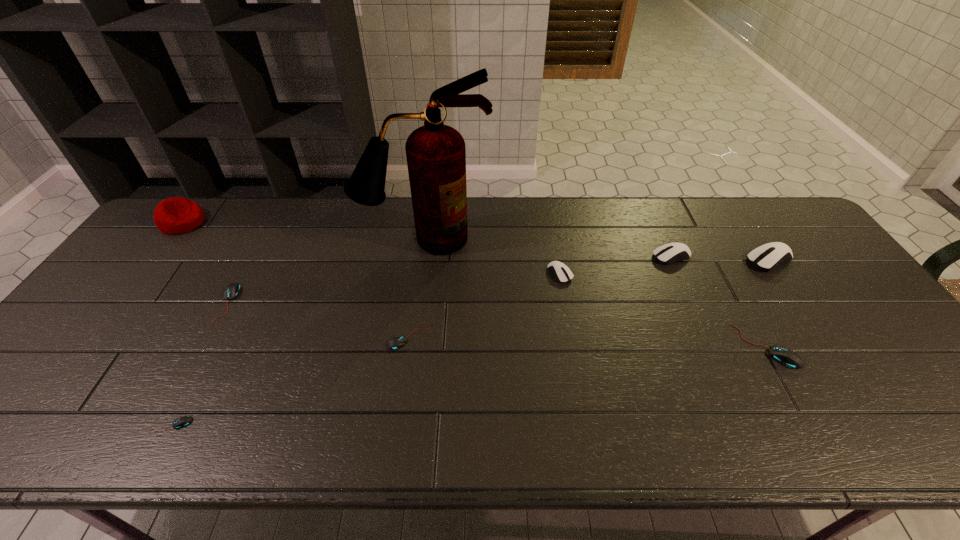
At what (x,y) coordinates should I click in order to perform the action: click on free spot located 0.400m on the left of the seventh shortest object. Please return your answer as a coordinate pair (x, y). Image resolution: width=960 pixels, height=540 pixels. Looking at the image, I should click on (612, 260).

I want to click on vacant space situated on the right of the second biggest white mouse, so click(817, 256).

I want to click on vacant space situated on the front of the third tallest mouse, so click(x=572, y=338).

Where is `vacant space located 0.150m on the front of the fourth tallest mouse`? Image resolution: width=960 pixels, height=540 pixels. vacant space located 0.150m on the front of the fourth tallest mouse is located at coordinates (812, 429).

What are the coordinates of `blank area located 0.200m on the left of the fifth tallest mouse` in the screenshot? It's located at (146, 303).

Locate an element on the screen. vacant space located on the left of the eighth tallest object is located at coordinates (254, 339).

Where is `free space located on the left of the smallest black mouse`? Image resolution: width=960 pixels, height=540 pixels. free space located on the left of the smallest black mouse is located at coordinates (86, 425).

Identify the location of fire extinguisher at the far edge. (436, 155).

Identify the location of beanbag that is at the far edge. (176, 215).

Find the location of a particular element. The image size is (960, 540). object that is positioned at the near edge is located at coordinates (181, 422).